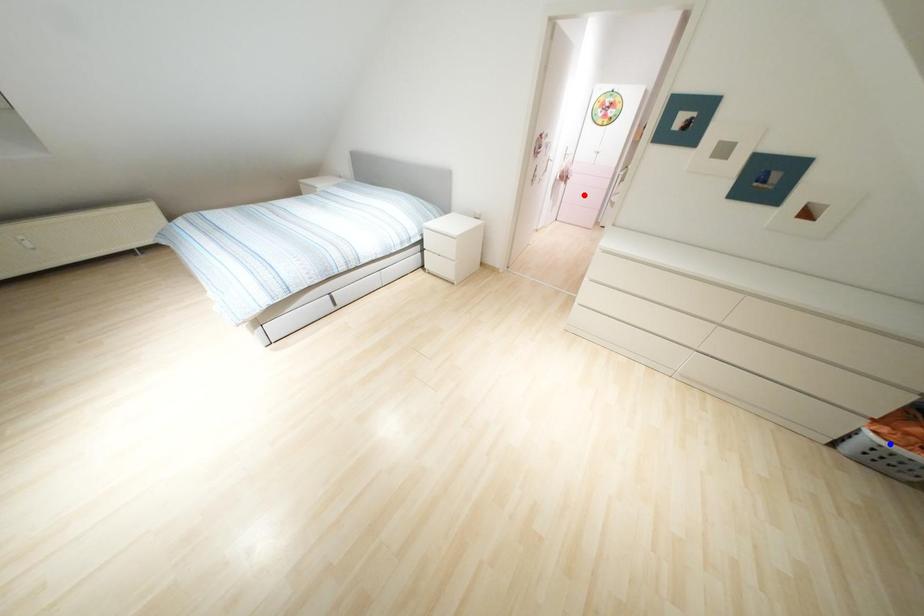
Question: Which of the two points in the image is closer to the camera?

Choices:
 (A) Blue point is closer.
 (B) Red point is closer.

Answer: (A)